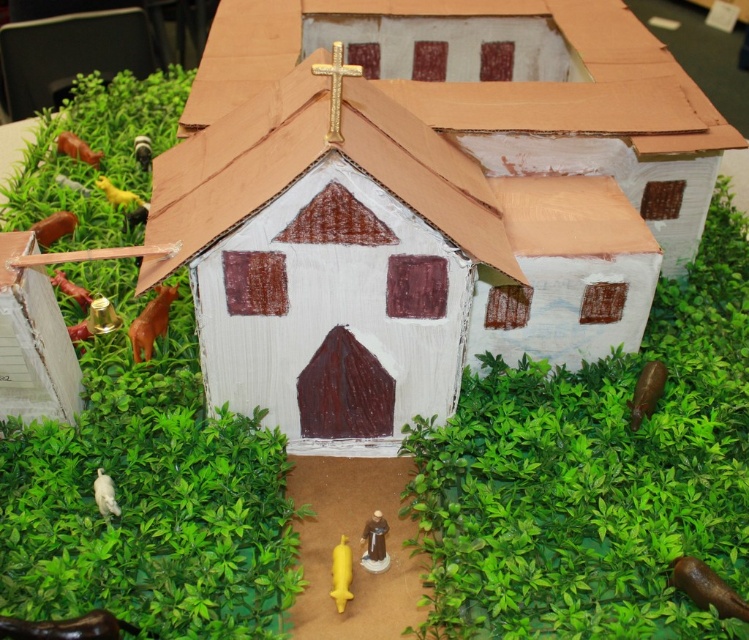
You are a visitor approaching the white cardboard hut at center and the matte brown statue at lower center in the church model. Which object do you need to look up more to see clearly?

The white cardboard hut at center is taller than the matte brown statue at lower center, so you need to look up more to see the white cardboard hut at center clearly.

You are a visitor approaching the church and want to take a photo of both the matte brown statue at lower center and the white matte bird at lower left. Which object should you focus on first to ensure both are in frame?

The matte brown statue at lower center is closer to the viewer than the white matte bird at lower left, so focus on the matte brown statue at lower center first to ensure both are in frame.